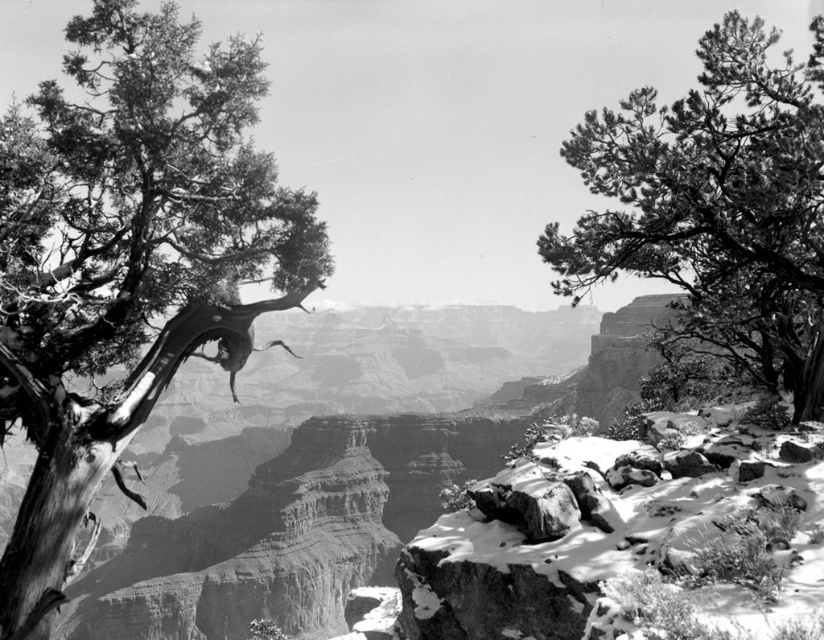
Question: Which object is farther from the camera taking this photo?

Choices:
 (A) dead wood tree at left
 (B) fine textured pine tree at upper right

Answer: (B)

Question: In this image, where is dead wood tree at left located relative to fine textured pine tree at upper right?

Choices:
 (A) above
 (B) below

Answer: (B)

Question: Which of the following is the farthest from the observer?

Choices:
 (A) dead wood tree at left
 (B) fine textured pine tree at upper right

Answer: (B)

Question: Can you confirm if dead wood tree at left is bigger than fine textured pine tree at upper right?

Choices:
 (A) no
 (B) yes

Answer: (A)

Question: Does dead wood tree at left appear under fine textured pine tree at upper right?

Choices:
 (A) yes
 (B) no

Answer: (A)